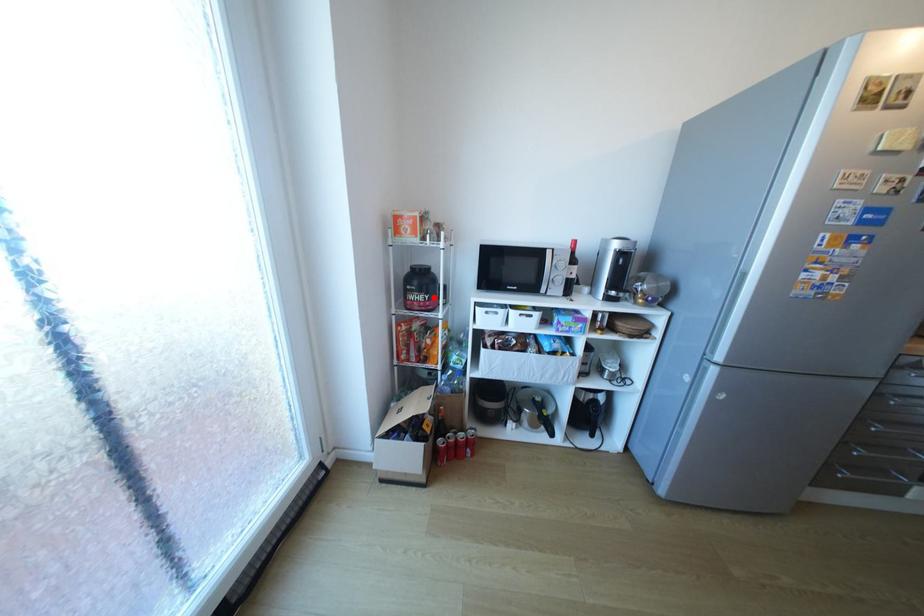
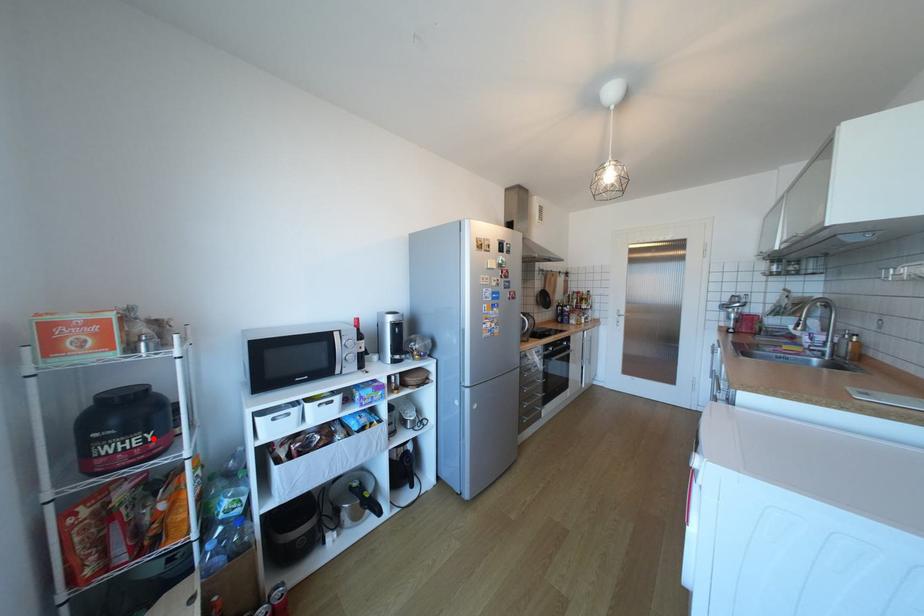
I am providing you with two images of the same scene from different viewpoints. A red point is marked on the first image and another point is marked on the second image. Is the red point in image1 aligned with the point shown in image2?

Yes